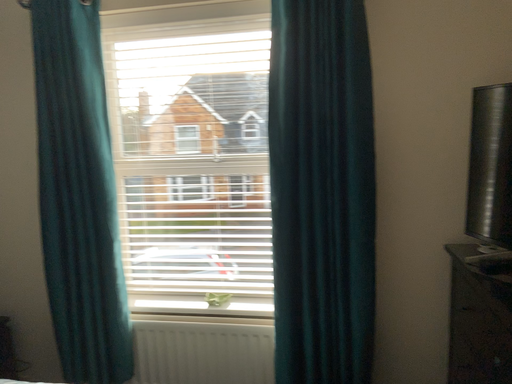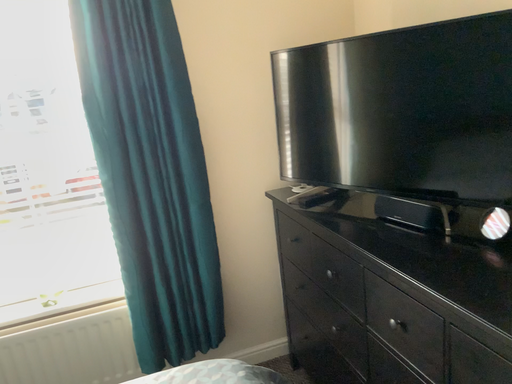
Question: How did the camera likely rotate when shooting the video?

Choices:
 (A) rotated left
 (B) rotated right

Answer: (B)